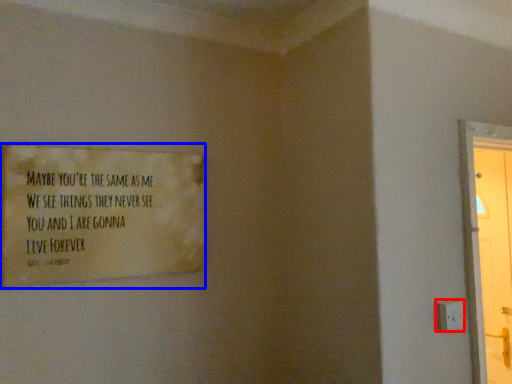
Question: Which object is further to the camera taking this photo, electric outlet (highlighted by a red box) or poster (highlighted by a blue box)?

Choices:
 (A) electric outlet
 (B) poster

Answer: (A)